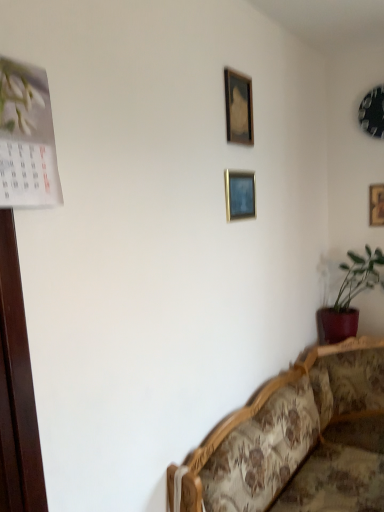
Question: Considering the positions of point (352, 328) and point (248, 97), is point (352, 328) closer or farther from the camera than point (248, 97)?

Choices:
 (A) closer
 (B) farther

Answer: (B)

Question: Based on their sizes in the image, would you say green matte plant at lower right is bigger or smaller than wooden picture frame at upper center, the 4th picture frame in the back-to-front sequence?

Choices:
 (A) small
 (B) big

Answer: (B)

Question: Based on their relative distances, which object is nearer to the floral fabric couch at lower right?

Choices:
 (A) metallic clock at upper right, positioned as the 2th picture frame in back-to-front order
 (B) matte wooden picture frame at upper center, acting as the 3th picture frame starting from the right
 (C) wooden picture frame at right, placed as the fourth picture frame when sorted from left to right
 (D) green matte plant at lower right
 (E) wooden picture frame at upper center, which appears as the 1th picture frame when viewed from the front

Answer: (D)

Question: Estimate the real-world distances between objects in this image. Which object is farther from the wooden picture frame at right, acting as the 1th picture frame starting from the back?

Choices:
 (A) metallic clock at upper right, the third picture frame in the front-to-back sequence
 (B) wooden picture frame at upper center, the 4th picture frame in the back-to-front sequence
 (C) floral fabric couch at lower right
 (D) matte wooden picture frame at upper center, acting as the 3th picture frame starting from the right
 (E) green matte plant at lower right

Answer: (C)